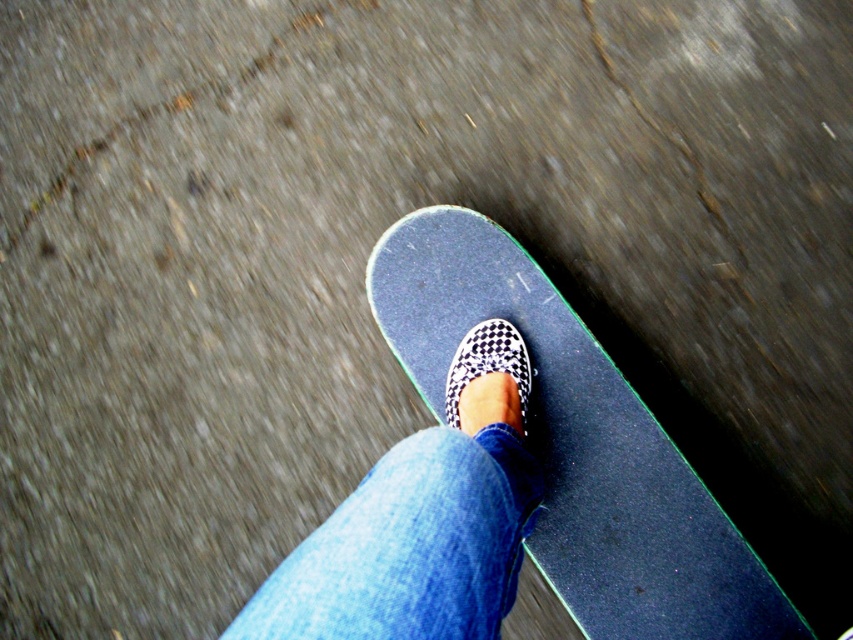
Is point (693, 490) positioned before point (450, 369)?

Yes.

Measure the distance from smooth black skateboard at center to black checkered slip-on shoe at center.

5.68 inches

At what (x,y) coordinates should I click in order to perform the action: click on smooth black skateboard at center. Please return your answer as a coordinate pair (x, y). Looking at the image, I should click on (577, 444).

You are a GUI agent. You are given a task and a screenshot of the screen. Output one action in this format:
    pyautogui.click(x=<x>, y=<y>)
    Task: Click on the smooth black skateboard at center
    The height and width of the screenshot is (640, 853).
    Given the screenshot: What is the action you would take?
    tap(577, 444)

Is point (456, 545) closer to camera compared to point (527, 364)?

Yes.

Image resolution: width=853 pixels, height=640 pixels. Describe the element at coordinates (422, 522) in the screenshot. I see `matte black skate shoe at center` at that location.

Where is `matte black skate shoe at center`? The width and height of the screenshot is (853, 640). matte black skate shoe at center is located at coordinates (422, 522).

Does smooth black skateboard at center have a lesser width compared to matte black skate shoe at center?

No, smooth black skateboard at center is not thinner than matte black skate shoe at center.

Locate an element on the screen. smooth black skateboard at center is located at coordinates (577, 444).